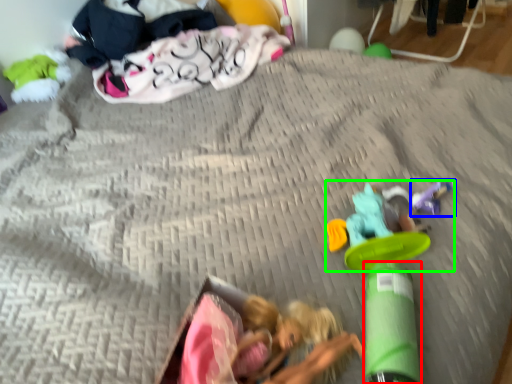
Question: Which is farther away from toy (highlighted by a red box)? toy (highlighted by a blue box) or toy (highlighted by a green box)?

Choices:
 (A) toy
 (B) toy

Answer: (A)